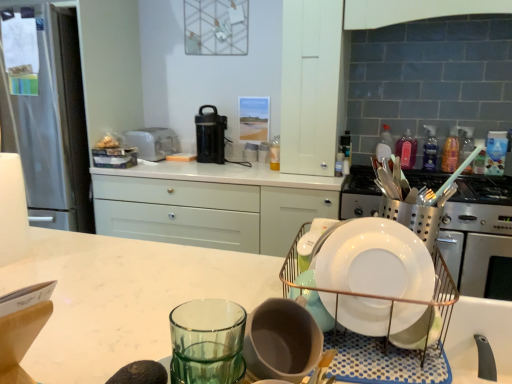
Question: Is white matte cabinet at upper center wider than black plastic coffee maker at center?

Choices:
 (A) no
 (B) yes

Answer: (B)

Question: From a real-world perspective, is white matte cabinet at upper center positioned under black plastic coffee maker at center based on gravity?

Choices:
 (A) no
 (B) yes

Answer: (A)

Question: Is white matte cabinet at upper center at the left side of black plastic coffee maker at center?

Choices:
 (A) yes
 (B) no

Answer: (B)

Question: From a real-world perspective, is white matte cabinet at upper center positioned over black plastic coffee maker at center based on gravity?

Choices:
 (A) no
 (B) yes

Answer: (B)

Question: Is white matte cabinet at upper center thinner than black plastic coffee maker at center?

Choices:
 (A) yes
 (B) no

Answer: (B)

Question: Is white matte cabinet at upper center aimed at black plastic coffee maker at center?

Choices:
 (A) yes
 (B) no

Answer: (B)

Question: Can you confirm if satin silver toaster at upper center is positioned to the right of green matte avocado at lower left, positioned as the 2th food in top-to-bottom order?

Choices:
 (A) yes
 (B) no

Answer: (B)

Question: Is satin silver toaster at upper center outside green matte avocado at lower left, the 1th food in the right-to-left sequence?

Choices:
 (A) yes
 (B) no

Answer: (A)

Question: Would you say green matte avocado at lower left, which is counted as the second food, starting from the back, is part of satin silver toaster at upper center's contents?

Choices:
 (A) no
 (B) yes

Answer: (A)

Question: Considering the relative sizes of satin silver toaster at upper center and green matte avocado at lower left, the 1th food in the right-to-left sequence, in the image provided, is satin silver toaster at upper center thinner than green matte avocado at lower left, the 1th food in the right-to-left sequence,?

Choices:
 (A) no
 (B) yes

Answer: (A)

Question: From the image's perspective, would you say satin silver toaster at upper center is positioned over green matte avocado at lower left, positioned as the 2th food in top-to-bottom order?

Choices:
 (A) yes
 (B) no

Answer: (A)

Question: Can you confirm if satin silver toaster at upper center is smaller than green matte avocado at lower left, the 1th food in the right-to-left sequence?

Choices:
 (A) yes
 (B) no

Answer: (B)

Question: Does satin silver toaster at upper center appear on the right side of pink plastic bottle at upper right, placed as the 5th bottle when sorted from left to right?

Choices:
 (A) yes
 (B) no

Answer: (B)